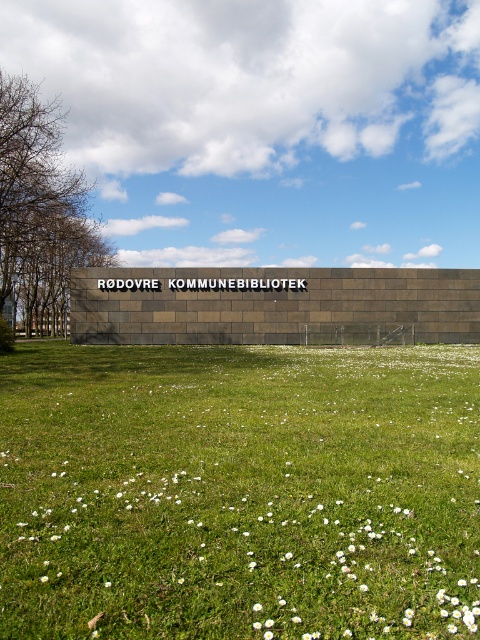
Who is taller, white fluffy flower at center or white matte flower at center?

With more height is white fluffy flower at center.

Between point (260, 609) and point (107, 582), which one is positioned in front?

Positioned in front is point (260, 609).

What do you see at coordinates (256, 605) in the screenshot? I see `white fluffy flower at center` at bounding box center [256, 605].

Image resolution: width=480 pixels, height=640 pixels. Identify the location of white fluffy flower at center. (256, 605).

Is point (180, 440) in front of point (107, 586)?

No, (180, 440) is behind (107, 586).

Identify the location of green grass at center. The width and height of the screenshot is (480, 640). (239, 492).

This screenshot has width=480, height=640. What do you see at coordinates (239, 492) in the screenshot? I see `green grass at center` at bounding box center [239, 492].

Identify the location of green grass at center. pyautogui.click(x=239, y=492).

How far apart are green grass at center and white fluffy flower at center?

A distance of 7.53 meters exists between green grass at center and white fluffy flower at center.

Who is more distant from viewer, (408, 445) or (252, 608)?

Positioned behind is point (408, 445).

Locate an element on the screen. Image resolution: width=480 pixels, height=640 pixels. green grass at center is located at coordinates (239, 492).